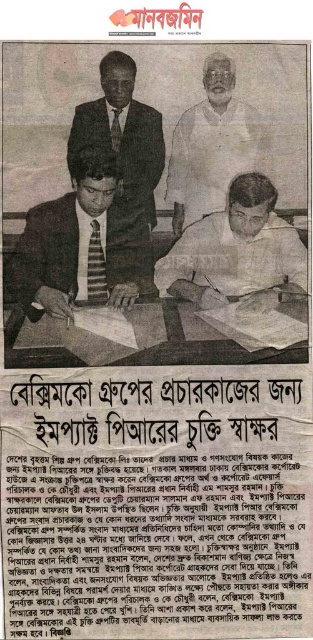
Who is shorter, black paper text at center or white cotton shirt at center?

white cotton shirt at center is shorter.

Does point (292, 481) come closer to viewer compared to point (184, 172)?

Yes.

Is point (145, 586) closer to camera compared to point (210, 147)?

Yes.

Find the location of a particular element. Image resolution: width=313 pixels, height=640 pixels. black paper text at center is located at coordinates (155, 504).

Can you confirm if black paper text at center is shorter than dark blue suit at center?

In fact, black paper text at center may be taller than dark blue suit at center.

Does black paper text at center have a smaller size compared to dark blue suit at center?

No, black paper text at center is not smaller than dark blue suit at center.

Identify the location of black paper text at center. The image size is (313, 640). (155, 504).

This screenshot has height=640, width=313. Find the location of `black paper text at center`. black paper text at center is located at coordinates (155, 504).

Is point (183, 289) positioned after point (221, 205)?

Yes, point (183, 289) is farther from viewer.

Which is above, matte black pen at center or white cotton shirt at center?

Positioned higher is white cotton shirt at center.

Locate an element on the screen. This screenshot has height=640, width=313. matte black pen at center is located at coordinates (236, 252).